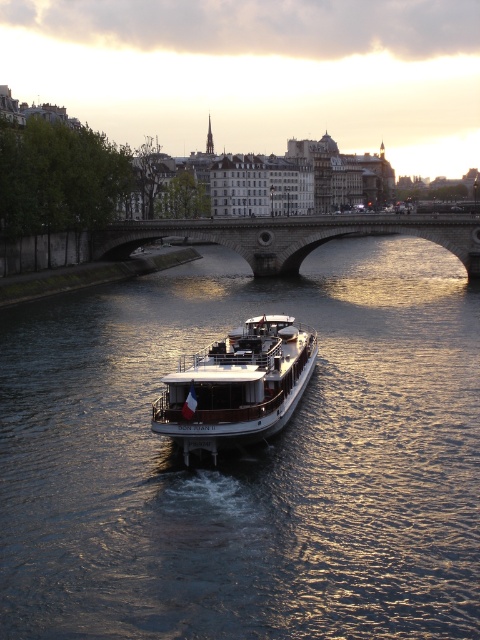
Question: Does shiny dark water at center appear on the left side of stone arch bridge at center?

Choices:
 (A) yes
 (B) no

Answer: (A)

Question: Which point is closer to the camera?

Choices:
 (A) stone arch bridge at center
 (B) shiny dark water at center
 (C) white polished wood boat at center

Answer: (B)

Question: Which of the following is the farthest from the observer?

Choices:
 (A) white polished wood boat at center
 (B) stone arch bridge at center
 (C) shiny dark water at center

Answer: (B)

Question: Is white polished wood boat at center to the left of stone arch bridge at center from the viewer's perspective?

Choices:
 (A) yes
 (B) no

Answer: (A)

Question: Can you confirm if shiny dark water at center is positioned to the right of white polished wood boat at center?

Choices:
 (A) yes
 (B) no

Answer: (A)

Question: Estimate the real-world distances between objects in this image. Which object is closer to the white polished wood boat at center?

Choices:
 (A) stone arch bridge at center
 (B) shiny dark water at center

Answer: (B)